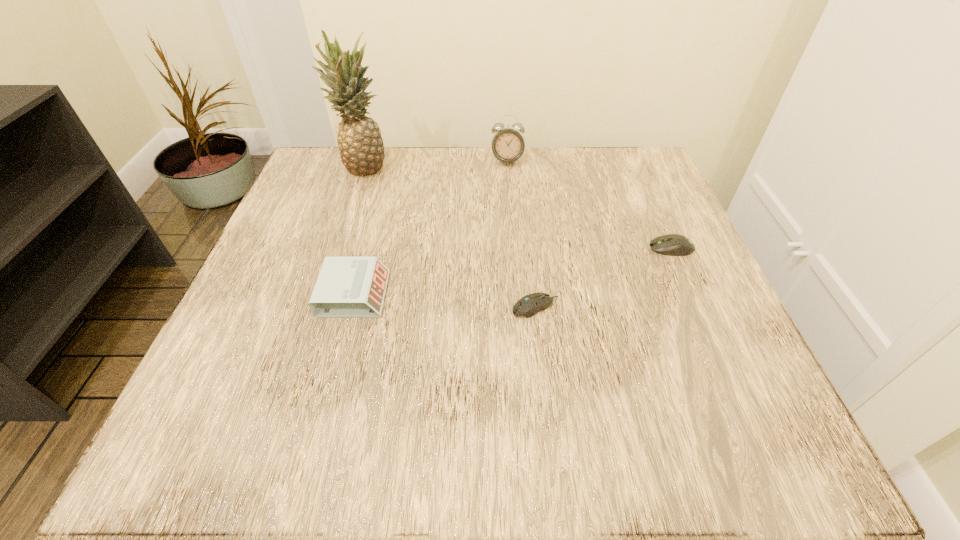
This screenshot has width=960, height=540. I want to click on free location located on the face of the right alarm clock, so click(x=514, y=240).

The width and height of the screenshot is (960, 540). Find the location of `vacant space situated on the right of the nearer alarm clock`. vacant space situated on the right of the nearer alarm clock is located at coordinates (492, 294).

Locate an element on the screen. vacant space located on the wheel side of the right computer mouse is located at coordinates (580, 248).

The height and width of the screenshot is (540, 960). I want to click on vacant region located on the wheel side of the right computer mouse, so click(601, 248).

The image size is (960, 540). What are the coordinates of `free spot located on the wheel side of the right computer mouse` in the screenshot? It's located at (537, 248).

Identify the location of vacant space located on the front of the nearer computer mouse. The height and width of the screenshot is (540, 960). (551, 440).

Locate an element on the screen. This screenshot has height=540, width=960. pineapple positioned at the far edge is located at coordinates (361, 148).

You are a GUI agent. You are given a task and a screenshot of the screen. Output one action in this format:
    pyautogui.click(x=<x>, y=<y>)
    Task: Click on the alarm clock that is at the far edge
    The image size is (960, 540).
    Given the screenshot: What is the action you would take?
    pyautogui.click(x=507, y=144)

Identify the location of pineapple located at the left edge. (361, 148).

Where is `alarm clock at the left edge`? This screenshot has width=960, height=540. alarm clock at the left edge is located at coordinates (347, 287).